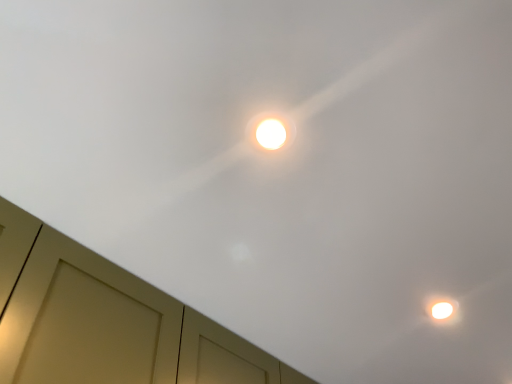
I want to click on white glossy droplight at center, so coord(271,131).

This screenshot has height=384, width=512. Describe the element at coordinates (271, 131) in the screenshot. I see `white glossy droplight at center` at that location.

Identify the location of matte wood dresser at lower left. (106, 321).

Measure the distance between point (202, 333) and camera.

The depth of point (202, 333) is 1.17 meters.

Image resolution: width=512 pixels, height=384 pixels. What do you see at coordinates (106, 321) in the screenshot? I see `matte wood dresser at lower left` at bounding box center [106, 321].

Identify the location of white glossy droplight at center. This screenshot has height=384, width=512. (271, 131).

Considering the relative positions of matte wood dresser at lower left and white glossy droplight at center in the image provided, is matte wood dresser at lower left to the left of white glossy droplight at center from the viewer's perspective?

Yes.

Does matte wood dresser at lower left lie in front of white glossy droplight at center?

Yes, it is in front of white glossy droplight at center.

Considering the positions of points (101, 351) and (277, 115), is point (101, 351) farther from camera compared to point (277, 115)?

Yes, it is.

From the image's perspective, is matte wood dresser at lower left on top of white glossy droplight at center?

No, from the image's perspective, matte wood dresser at lower left is not over white glossy droplight at center.

From a real-world perspective, is matte wood dresser at lower left over white glossy droplight at center?

Actually, matte wood dresser at lower left is physically below white glossy droplight at center in the real world.

Can you confirm if matte wood dresser at lower left is thinner than white glossy droplight at center?

No, matte wood dresser at lower left is not thinner than white glossy droplight at center.

In terms of height, does matte wood dresser at lower left look taller or shorter compared to white glossy droplight at center?

Clearly, matte wood dresser at lower left is taller compared to white glossy droplight at center.

Considering the sizes of objects matte wood dresser at lower left and white glossy droplight at center in the image provided, who is bigger, matte wood dresser at lower left or white glossy droplight at center?

Bigger between the two is matte wood dresser at lower left.

Would you say white glossy droplight at center is part of matte wood dresser at lower left's contents?

Actually, white glossy droplight at center is outside matte wood dresser at lower left.

Is matte wood dresser at lower left directly adjacent to white glossy droplight at center?

No.

Does matte wood dresser at lower left turn towards white glossy droplight at center?

Yes, matte wood dresser at lower left is facing white glossy droplight at center.

How different are the orientations of matte wood dresser at lower left and white glossy droplight at center in degrees?

They differ by 0.00128 degrees in their facing directions.

Measure the distance between matte wood dresser at lower left and white glossy droplight at center.

They are 20.97 inches apart.

Find the location of a particular element. This screenshot has height=384, width=512. dresser below the white glossy droplight at center (from the image's perspective) is located at coordinates (106, 321).

Is white glossy droplight at center at the right side of matte wood dresser at lower left?

Correct, you'll find white glossy droplight at center to the right of matte wood dresser at lower left.

Does white glossy droplight at center lie in front of matte wood dresser at lower left?

No.

Between point (286, 117) and point (53, 339), which one is positioned in front?

The point (286, 117) is closer.

From the image's perspective, would you say white glossy droplight at center is positioned over matte wood dresser at lower left?

Correct, white glossy droplight at center appears higher than matte wood dresser at lower left in the image.

From a real-world perspective, is white glossy droplight at center physically located above or below matte wood dresser at lower left?

From a real-world perspective, white glossy droplight at center is physically above matte wood dresser at lower left.

Which object is wider, white glossy droplight at center or matte wood dresser at lower left?

matte wood dresser at lower left is wider.

Does white glossy droplight at center have a lesser height compared to matte wood dresser at lower left?

Indeed, white glossy droplight at center has a lesser height compared to matte wood dresser at lower left.

Who is smaller, white glossy droplight at center or matte wood dresser at lower left?

Smaller between the two is white glossy droplight at center.

Is white glossy droplight at center not inside matte wood dresser at lower left?

white glossy droplight at center lies outside matte wood dresser at lower left's area.

Are white glossy droplight at center and matte wood dresser at lower left far apart?

No, white glossy droplight at center is in close proximity to matte wood dresser at lower left.

Is matte wood dresser at lower left at the back of white glossy droplight at center?

Correct, white glossy droplight at center is looking away from matte wood dresser at lower left.

How different are the orientations of white glossy droplight at center and matte wood dresser at lower left in degrees?

0.00128 degrees separate the facing orientations of white glossy droplight at center and matte wood dresser at lower left.

Based on the photo, measure the distance between white glossy droplight at center and matte wood dresser at lower left.

white glossy droplight at center and matte wood dresser at lower left are 20.97 inches apart.

Find the location of a particular element. dresser located on the left of white glossy droplight at center is located at coordinates 106,321.

At what (x,y) coordinates should I click in order to perform the action: click on droplight located above the matte wood dresser at lower left (from a real-world perspective). Please return your answer as a coordinate pair (x, y). Image resolution: width=512 pixels, height=384 pixels. Looking at the image, I should click on (271, 131).

Locate an element on the screen. The height and width of the screenshot is (384, 512). droplight lying behind the matte wood dresser at lower left is located at coordinates (271, 131).